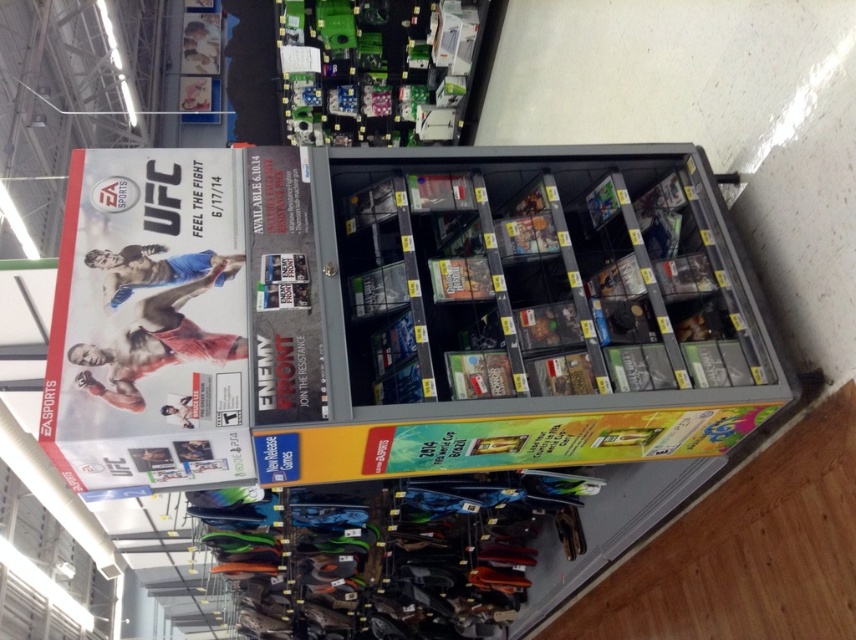
Question: Which object is closer to the camera taking this photo?

Choices:
 (A) metallic gray shelf at center
 (B) green plastic electronics at upper center

Answer: (A)

Question: Is matte plastic ufc poster at upper left wider than green plastic electronics at upper center?

Choices:
 (A) no
 (B) yes

Answer: (A)

Question: Which object is the farthest from the matte plastic ufc poster at upper left?

Choices:
 (A) green plastic electronics at upper center
 (B) metallic gray shelf at center

Answer: (A)

Question: Which object appears closest to the camera in this image?

Choices:
 (A) metallic gray shelf at center
 (B) matte plastic ufc poster at upper left
 (C) green plastic electronics at upper center

Answer: (B)

Question: Is metallic gray shelf at center further to camera compared to matte plastic ufc poster at upper left?

Choices:
 (A) no
 (B) yes

Answer: (B)

Question: Can you confirm if metallic gray shelf at center is bigger than green plastic electronics at upper center?

Choices:
 (A) no
 (B) yes

Answer: (A)